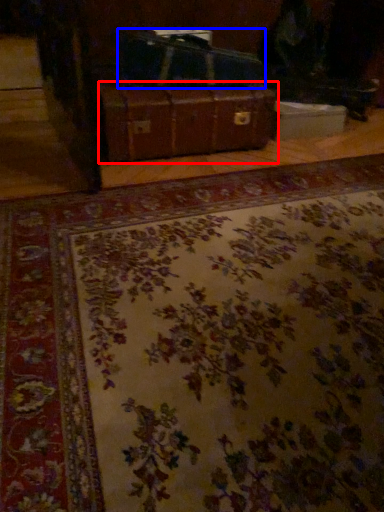
Question: Which object appears closest to the camera in this image, suitcase (highlighted by a red box) or luggage (highlighted by a blue box)?

Choices:
 (A) suitcase
 (B) luggage

Answer: (A)